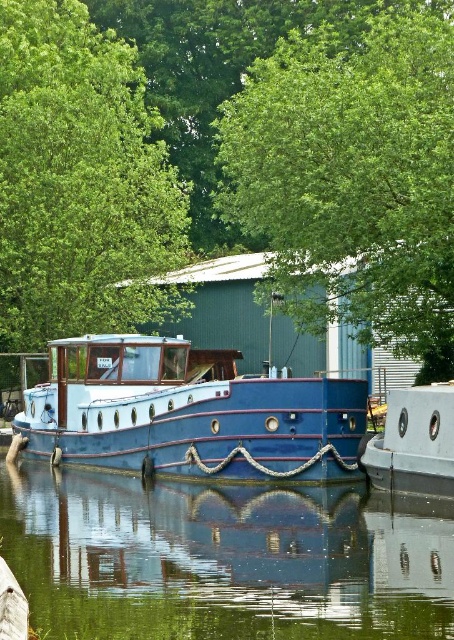
Question: Among these points, which one is farthest from the camera?

Choices:
 (A) (64, 3)
 (B) (143, 598)
 (C) (389, 296)

Answer: (A)

Question: Is transparent glass water at center positioned in front of metallic blue boat at center?

Choices:
 (A) no
 (B) yes

Answer: (B)

Question: Is green leafy tree at upper center closer to camera compared to matte blue boat at center?

Choices:
 (A) yes
 (B) no

Answer: (A)

Question: Among these points, which one is nearest to the camera?

Choices:
 (A) (346, 600)
 (B) (438, 449)
 (C) (272, 452)

Answer: (A)

Question: Is transparent glass water at center bigger than matte blue boat at center?

Choices:
 (A) yes
 (B) no

Answer: (B)

Question: Which of these objects is positioned farthest from the matte blue boat at center?

Choices:
 (A) transparent glass water at center
 (B) metallic blue boat at center
 (C) green leafy tree at upper left

Answer: (C)